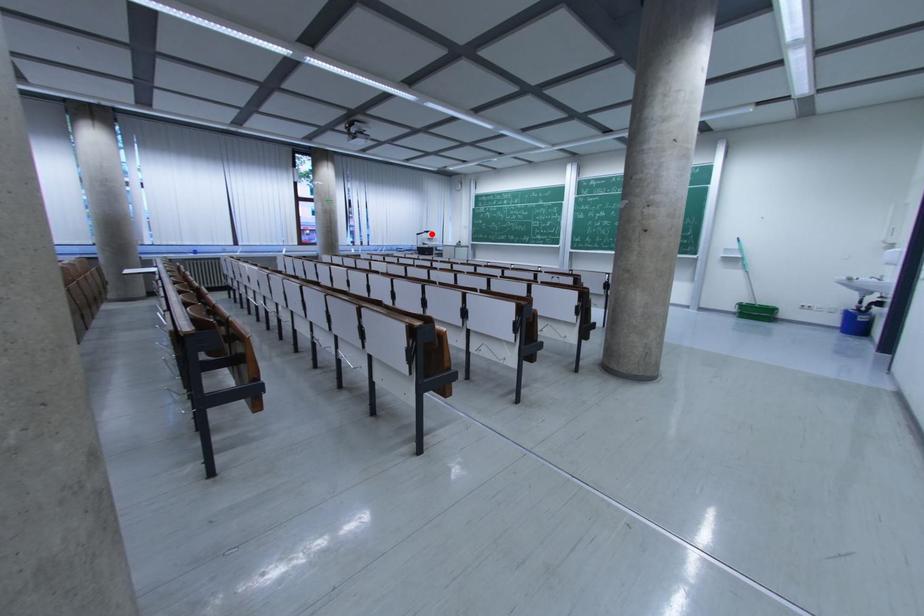
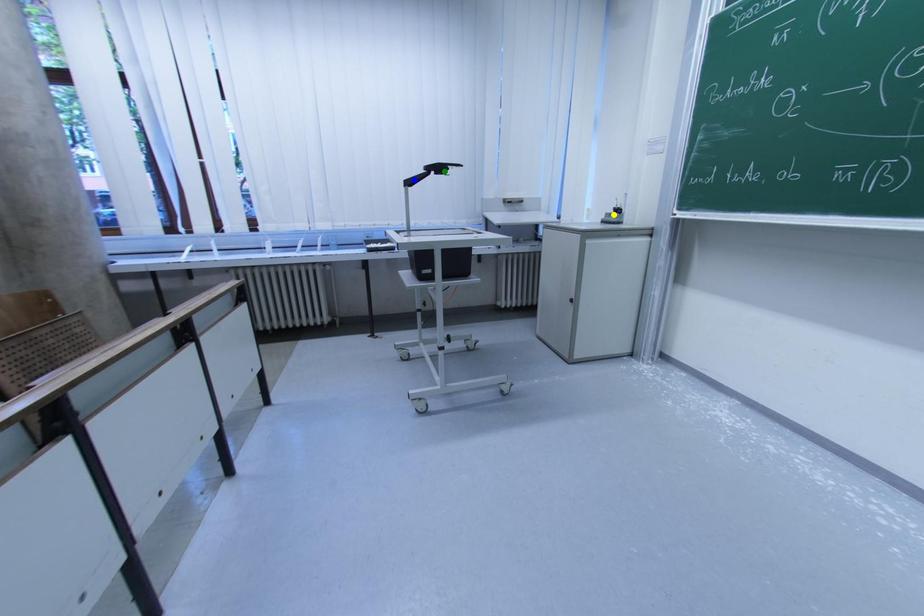
Question: I am providing you with two images of the same scene from different viewpoints. A red point is marked on the first image. You are given multiple points on the second image. Which spot in image 2 lines up with the point in image 1?

Choices:
 (A) yellow point
 (B) blue point
 (C) green point

Answer: (C)